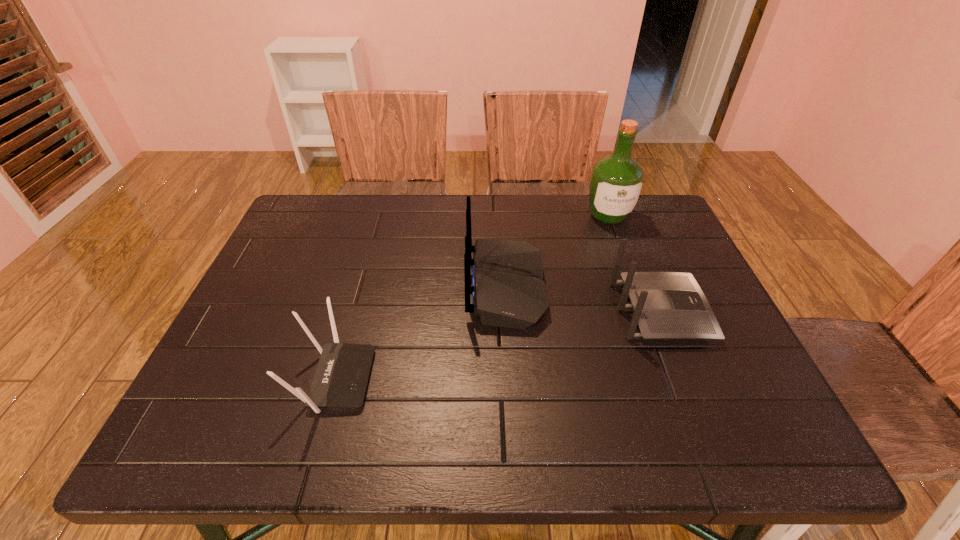
Image resolution: width=960 pixels, height=540 pixels. I want to click on vacant space that satisfies the following two spatial constraints: 1. on the front-facing side of the tallest object; 2. on the back of the third object from right to left, so click(x=635, y=287).